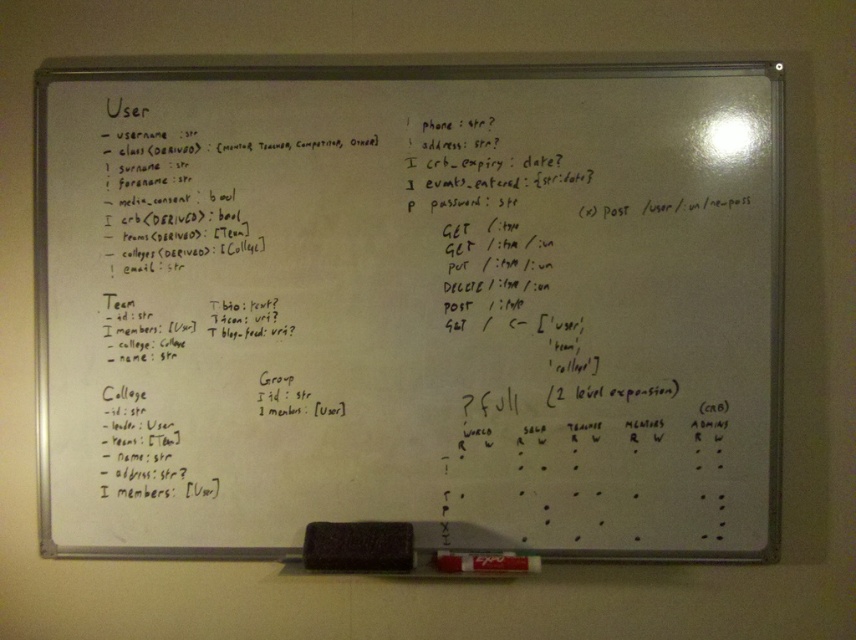
Question: Where is whiteboard at center located in relation to black matte marker at bottom in the image?

Choices:
 (A) above
 (B) below

Answer: (A)

Question: Which point appears farthest from the camera in this image?

Choices:
 (A) (168, 355)
 (B) (345, 525)

Answer: (A)

Question: Is whiteboard at center behind black matte marker at bottom?

Choices:
 (A) yes
 (B) no

Answer: (A)

Question: Which point is closer to the camera?

Choices:
 (A) black matte marker at bottom
 (B) whiteboard at center

Answer: (A)

Question: Is whiteboard at center to the right of black matte marker at bottom from the viewer's perspective?

Choices:
 (A) no
 (B) yes

Answer: (B)